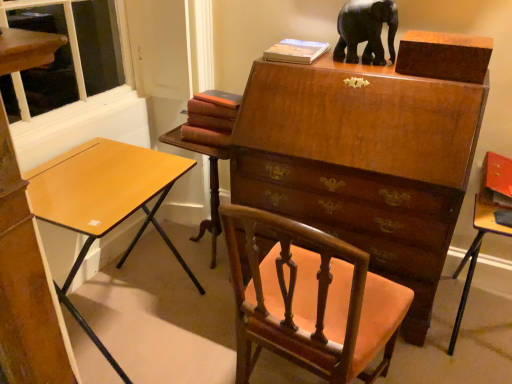
Identify the location of vacant area situated to the left side of mahogany wood table at center, which appears as the 2th table when viewed from the right. The height and width of the screenshot is (384, 512). (161, 250).